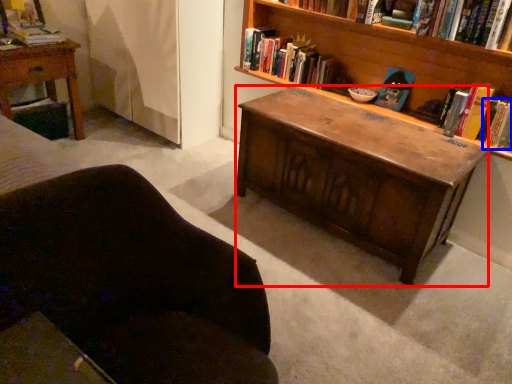
Question: Which of the following is the farthest to the observer, desk (highlighted by a red box) or book (highlighted by a blue box)?

Choices:
 (A) desk
 (B) book

Answer: (B)